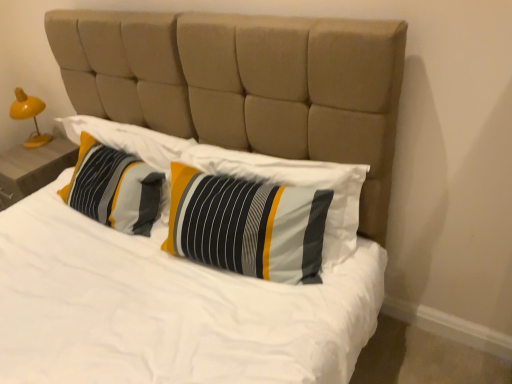
The width and height of the screenshot is (512, 384). I want to click on free space above yellow wood nightstand at left (from a real-world perspective), so click(44, 147).